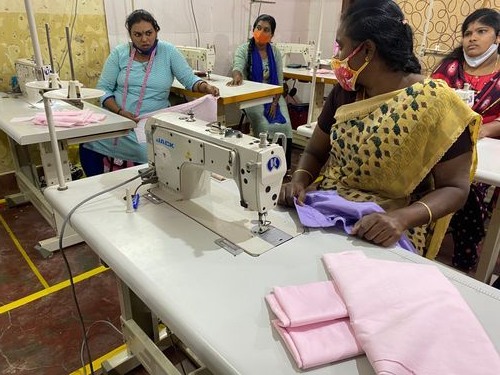
You are a GUI agent. You are given a task and a screenshot of the screen. Output one action in this format:
    pyautogui.click(x=<x>, y=<y>)
    Task: Click on the light and dark brown wall right top corner
    Image resolution: width=500 pixels, height=375 pixels.
    Given the screenshot: What is the action you would take?
    pyautogui.click(x=437, y=16)